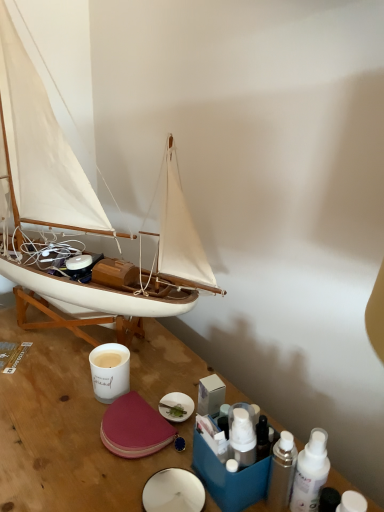
Identify the location of vacant region above wooden table at center (from a real-world perspective). (86, 391).